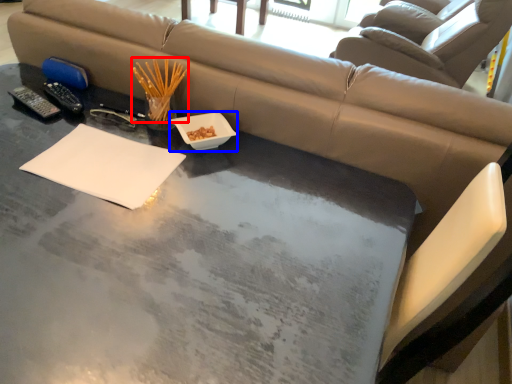
Question: Which of the following is the farthest to the observer, chopstick (highlighted by a red box) or bowl (highlighted by a blue box)?

Choices:
 (A) chopstick
 (B) bowl

Answer: (A)